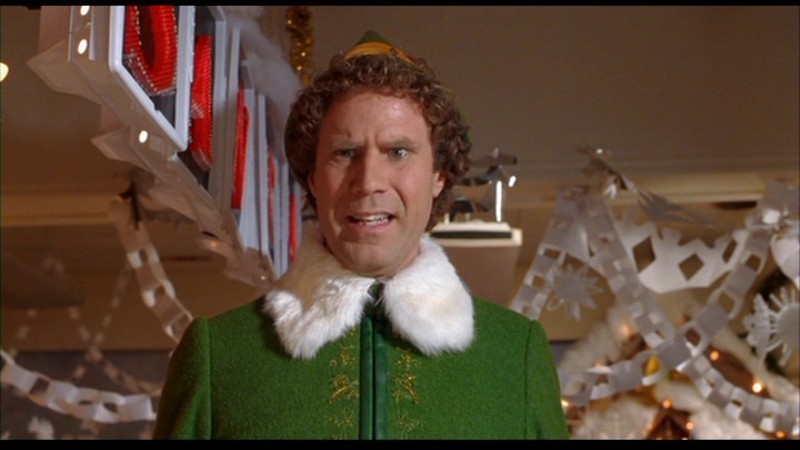
What are the coordinates of `golden trim` in the screenshot? It's located at (348, 380), (344, 432), (402, 364), (404, 422).